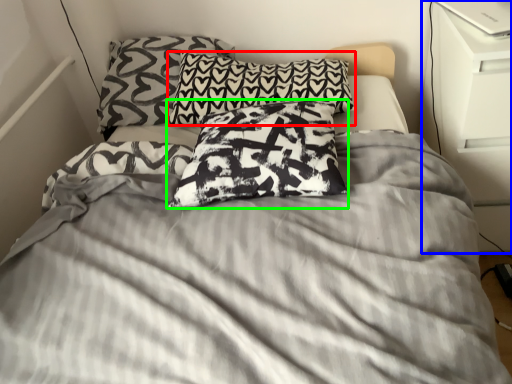
Question: Which object is the closest to the pillow (highlighted by a red box)? Choose among these: dresser (highlighted by a blue box) or pillow (highlighted by a green box).

Choices:
 (A) dresser
 (B) pillow

Answer: (B)